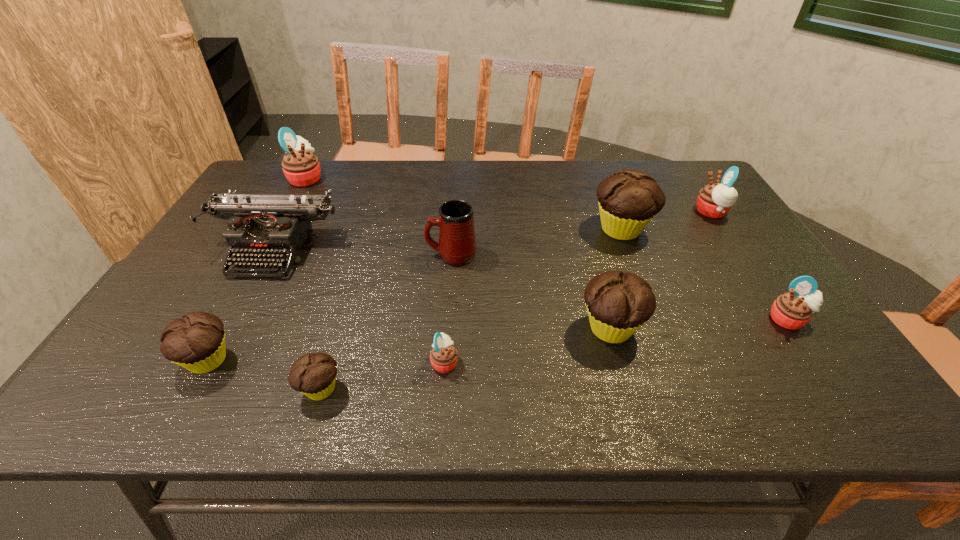
This screenshot has height=540, width=960. I want to click on vacant point located between the third biggest pink muffin and the farthest muffin, so click(547, 249).

This screenshot has height=540, width=960. Find the location of `unoccupied position between the fourth object from left to right and the third biggest chocolate muffin`. unoccupied position between the fourth object from left to right and the third biggest chocolate muffin is located at coordinates (264, 375).

Where is `vacant space that's between the second biggest chocolate muffin and the seventh object from right to left`? This screenshot has width=960, height=540. vacant space that's between the second biggest chocolate muffin and the seventh object from right to left is located at coordinates (466, 359).

I want to click on free space between the smallest pink muffin and the red mug, so click(x=448, y=308).

This screenshot has height=540, width=960. What are the coordinates of `free space that is in between the third nearest pink muffin and the biggest chocolate muffin` in the screenshot? It's located at click(666, 221).

At what (x,y) coordinates should I click in order to perform the action: click on free space between the leftmost chocolate muffin and the third biggest pink muffin. Please return your answer as a coordinate pair (x, y). The width and height of the screenshot is (960, 540). Looking at the image, I should click on (498, 340).

The image size is (960, 540). What are the coordinates of `unoccupied area between the second smallest chocolate muffin and the typewriter` in the screenshot? It's located at (242, 305).

Locate an element on the screen. the seventh closest object to the leftmost pink muffin is located at coordinates (618, 304).

Locate which object ranks fourth in proximity to the third pink muffin from right to left. Please provide its 2D coordinates. Your answer should be formatted as a tuple, i.e. [(x, y)], where the tuple contains the x and y coordinates of a point satisfying the conditions above.

[(260, 226)]

You are a GUI agent. You are given a task and a screenshot of the screen. Output one action in this format:
    pyautogui.click(x=<x>, y=<y>)
    Task: Click on the seventh closest muffin to the third biggest chocolate muffin
    
    Given the screenshot: What is the action you would take?
    pyautogui.click(x=714, y=200)